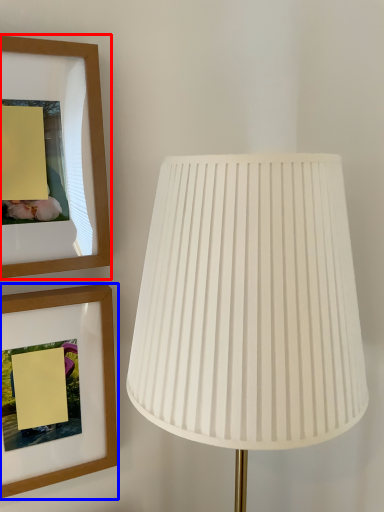
Question: Among these objects, which one is farthest to the camera, picture frame (highlighted by a red box) or picture frame (highlighted by a blue box)?

Choices:
 (A) picture frame
 (B) picture frame

Answer: (B)